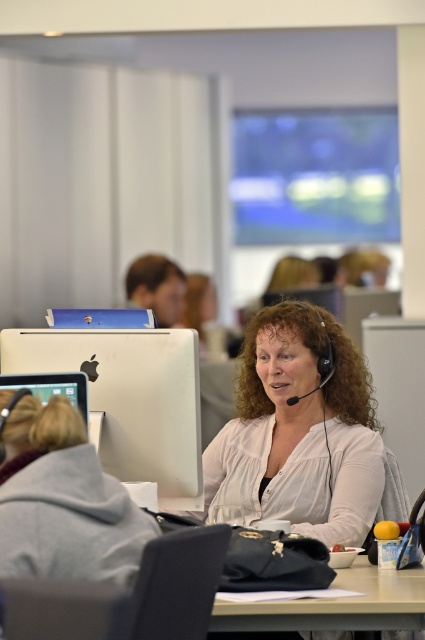
You are an office worker who needs to place a new monitor between the white matte computer at left and the smooth white table at center. According to the scene, where should the monitor be placed?

The white matte computer at left is positioned on the left side of the smooth white table at center, so the new monitor should be placed between them, to the right of the white matte computer at left and to the left of the smooth white table at center.

You are an office worker who needs to locate the white matte computer at left. According to the coordinates provided, where should you look in the image?

You should look at point 0.623 on the horizontal axis and point 0.306 on the vertical axis to find the white matte computer at left.

You are organizing a workspace and need to stack items vertically. You have a matte gray laptop at left and a smooth white table at center. Which object can be placed on top of the other without tipping over?

The matte gray laptop at left is thinner than the smooth white table at center, so the laptop can be placed on top of the table without tipping over.